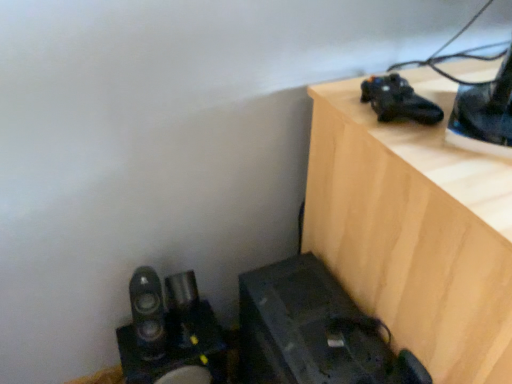
Locate an element on the screen. black matte shoe at upper right is located at coordinates (398, 100).

The height and width of the screenshot is (384, 512). Describe the element at coordinates (398, 100) in the screenshot. I see `black matte shoe at upper right` at that location.

What do you see at coordinates (414, 229) in the screenshot? This screenshot has height=384, width=512. I see `wooden table at upper right` at bounding box center [414, 229].

What is the approximate height of satin black speakers at lower left?

9.95 inches.

Find the location of a particular element. black matte shoe at upper right is located at coordinates (398, 100).

Does wooden table at upper right contain black matte shoe at upper right?

Definitely not — black matte shoe at upper right is not inside wooden table at upper right.

In the scene shown: From a real-world perspective, is wooden table at upper right physically below black matte shoe at upper right?

Yes, from a real-world perspective, wooden table at upper right is under black matte shoe at upper right.

Is wooden table at upper right thinner than black matte shoe at upper right?

Incorrect, the width of wooden table at upper right is not less than that of black matte shoe at upper right.

Who is more distant, wooden table at upper right or satin black speakers at lower left?

Positioned behind is satin black speakers at lower left.

How different are the orientations of wooden table at upper right and satin black speakers at lower left in degrees?

The angle between the facing direction of wooden table at upper right and the facing direction of satin black speakers at lower left is 8.58e-06 degrees.

From the image's perspective, is wooden table at upper right below satin black speakers at lower left?

No.

Looking at this image, is wooden table at upper right to the right of satin black speakers at lower left from the viewer's perspective?

Yes.

Consider the image. Can you confirm if satin black speakers at lower left is shorter than wooden table at upper right?

Correct, satin black speakers at lower left is not as tall as wooden table at upper right.

From the image's perspective, between satin black speakers at lower left and wooden table at upper right, which one is located above?

wooden table at upper right is shown above in the image.

Which point is more forward, (182, 285) or (423, 339)?

The point (423, 339) is closer.

Does satin black speakers at lower left have a smaller size compared to wooden table at upper right?

Correct, satin black speakers at lower left occupies less space than wooden table at upper right.

Could you tell me if black matte shoe at upper right is facing satin black speakers at lower left?

No, black matte shoe at upper right is not oriented towards satin black speakers at lower left.

Does black matte shoe at upper right appear on the left side of satin black speakers at lower left?

Incorrect, black matte shoe at upper right is not on the left side of satin black speakers at lower left.

From the image's perspective, is black matte shoe at upper right under satin black speakers at lower left?

Incorrect, from the image's perspective, black matte shoe at upper right is higher than satin black speakers at lower left.

Looking at their sizes, would you say satin black speakers at lower left is wider or thinner than black matte shoe at upper right?

Clearly, satin black speakers at lower left has more width compared to black matte shoe at upper right.

Is satin black speakers at lower left located outside black matte shoe at upper right?

satin black speakers at lower left is positioned outside black matte shoe at upper right.

Where is `shoe above the satin black speakers at lower left (from a real-world perspective)`? Image resolution: width=512 pixels, height=384 pixels. shoe above the satin black speakers at lower left (from a real-world perspective) is located at coordinates (398, 100).

Which object is positioned more to the right, satin black speakers at lower left or black matte shoe at upper right?

black matte shoe at upper right is more to the right.

Is black matte shoe at upper right inside or outside of wooden table at upper right?

black matte shoe at upper right is located beyond the bounds of wooden table at upper right.

Which of these two, black matte shoe at upper right or wooden table at upper right, stands shorter?

Standing shorter between the two is black matte shoe at upper right.

What's the angular difference between black matte shoe at upper right and wooden table at upper right's facing directions?

black matte shoe at upper right and wooden table at upper right are facing 15.1 degrees away from each other.

Image resolution: width=512 pixels, height=384 pixels. In the image, there is a black matte shoe at upper right. Find the location of `furniture below it (from the image's perspective)`. furniture below it (from the image's perspective) is located at coordinates (414, 229).

The width and height of the screenshot is (512, 384). I want to click on shoe above the wooden table at upper right (from a real-world perspective), so click(x=398, y=100).

Image resolution: width=512 pixels, height=384 pixels. I want to click on equipment behind the wooden table at upper right, so click(x=170, y=333).

Which object lies further to the anchor point satin black speakers at lower left, black matte shoe at upper right or wooden table at upper right?

black matte shoe at upper right lies further to satin black speakers at lower left than the other object.

Looking at the image, which one is located closer to black matte shoe at upper right, satin black speakers at lower left or wooden table at upper right?

wooden table at upper right.

In the scene shown: From the image, which object appears to be farther from wooden table at upper right, satin black speakers at lower left or black matte shoe at upper right?

Among the two, satin black speakers at lower left is located further to wooden table at upper right.

Looking at the image, which one is located further to satin black speakers at lower left, wooden table at upper right or black matte shoe at upper right?

black matte shoe at upper right is further to satin black speakers at lower left.

Estimate the real-world distances between objects in this image. Which object is closer to wooden table at upper right, black matte shoe at upper right or satin black speakers at lower left?

black matte shoe at upper right is closer to wooden table at upper right.

Estimate the real-world distances between objects in this image. Which object is further from black matte shoe at upper right, wooden table at upper right or satin black speakers at lower left?

satin black speakers at lower left is further to black matte shoe at upper right.

Where is `shoe between satin black speakers at lower left and wooden table at upper right in the horizontal direction`? The image size is (512, 384). shoe between satin black speakers at lower left and wooden table at upper right in the horizontal direction is located at coordinates (398, 100).